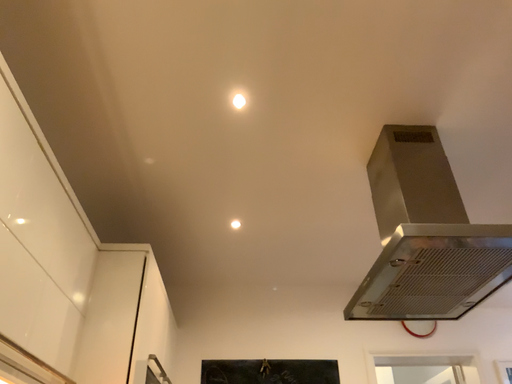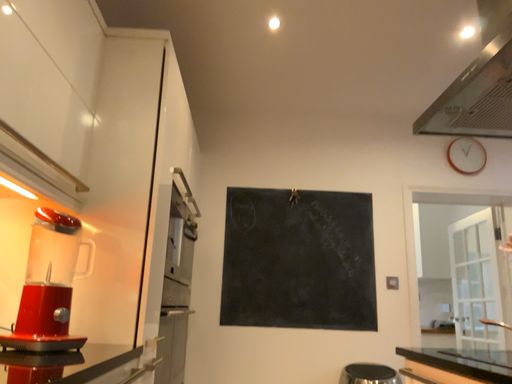
Question: How did the camera likely rotate when shooting the video?

Choices:
 (A) rotated downward
 (B) rotated upward

Answer: (A)